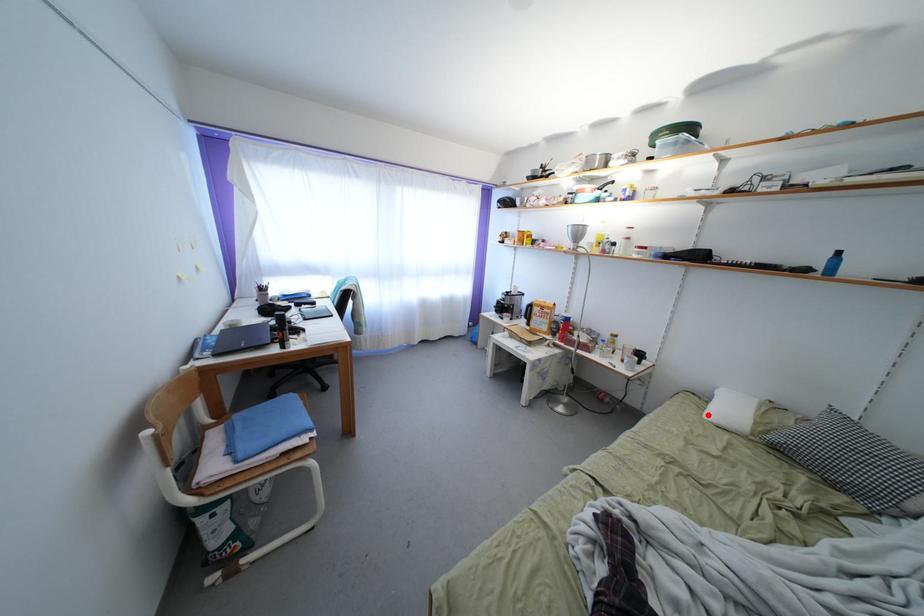
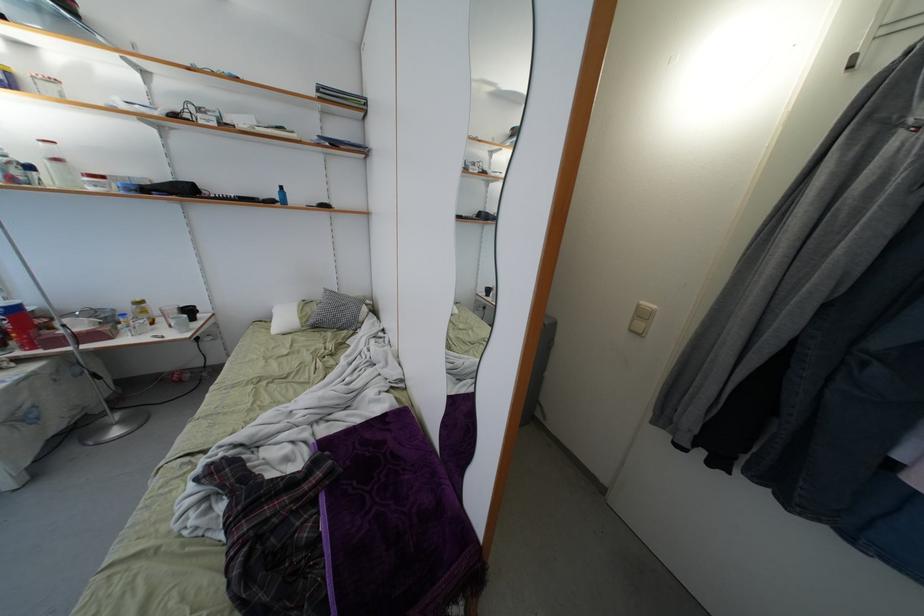
Locate, in the second image, the point that corresponds to the highlighted location in the first image.

(274, 334)